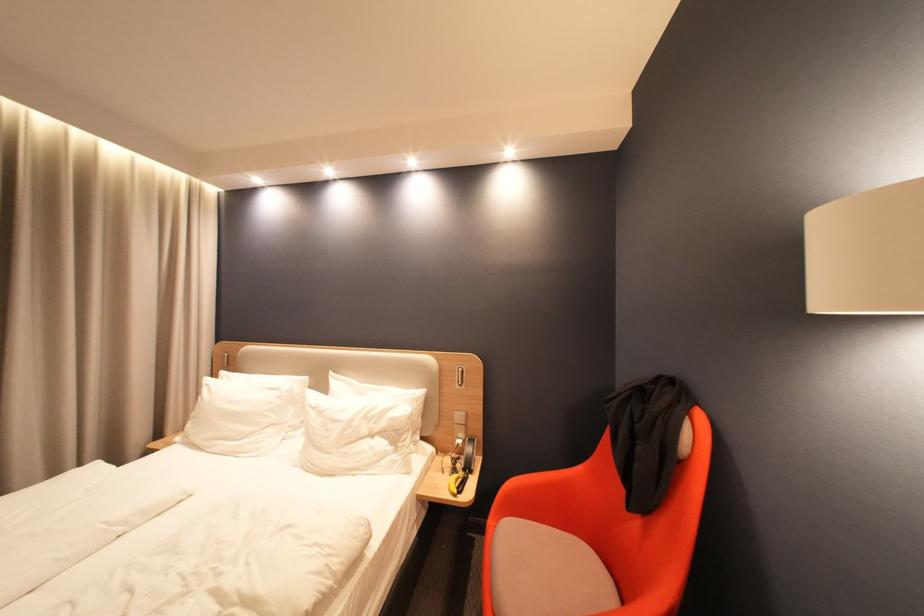
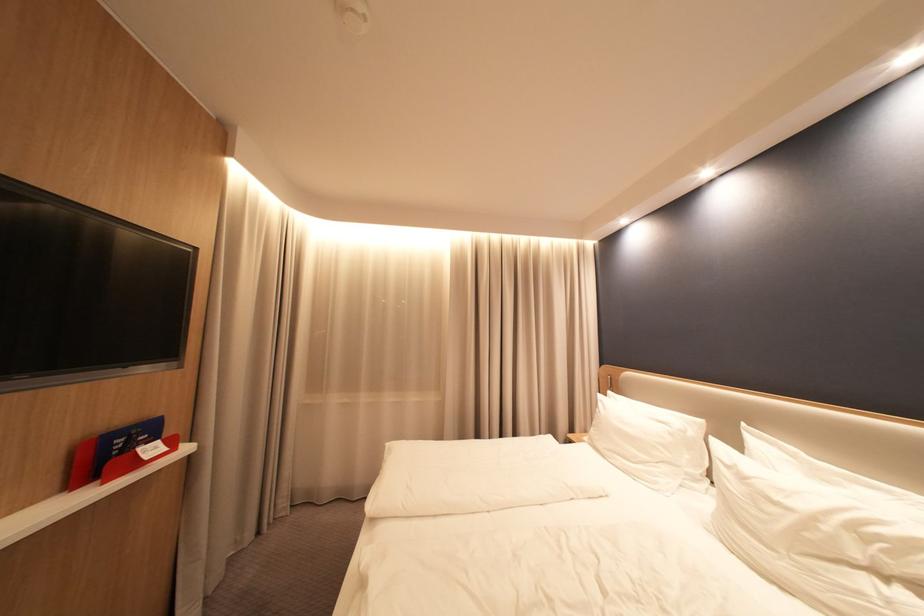
Find the pixel in the second image that matches (323,407) in the first image.

(737, 464)